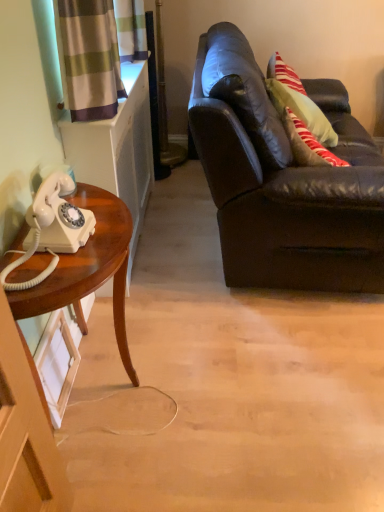
You are a GUI agent. You are given a task and a screenshot of the screen. Output one action in this format:
    pyautogui.click(x=<x>, y=<y>)
    Task: Click on the vacant space underneath wooden desk at left (from a real-world perspective)
    Image resolution: width=384 pixels, height=512 pixels.
    Given the screenshot: What is the action you would take?
    pyautogui.click(x=104, y=390)